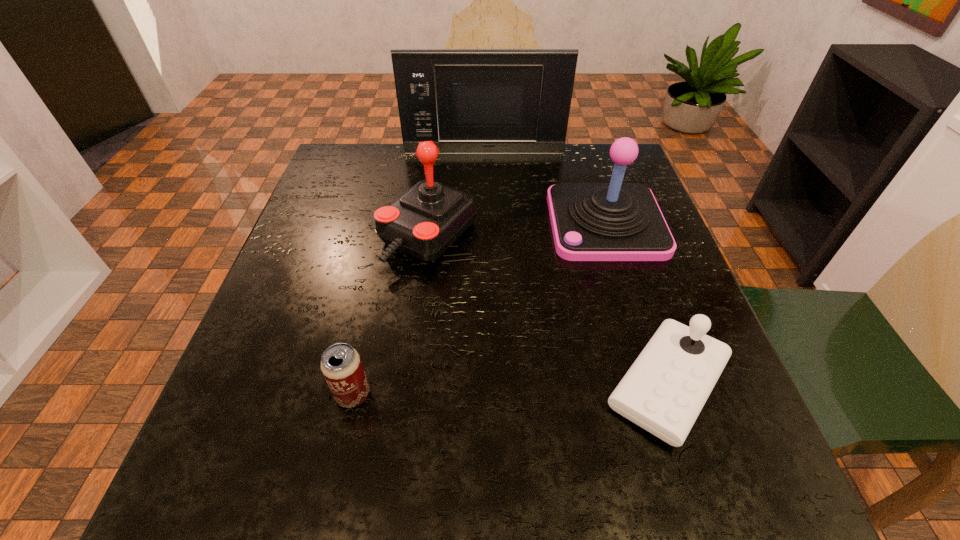
You are a GUI agent. You are given a task and a screenshot of the screen. Output one action in this format:
    pyautogui.click(x=<x>, y=<y>)
    Task: Click on the free space that satisfies the following two spatial constraints: 1. on the front panel of the tallest object; 2. on the left side of the shortest joystick
    
    Given the screenshot: What is the action you would take?
    pyautogui.click(x=487, y=385)